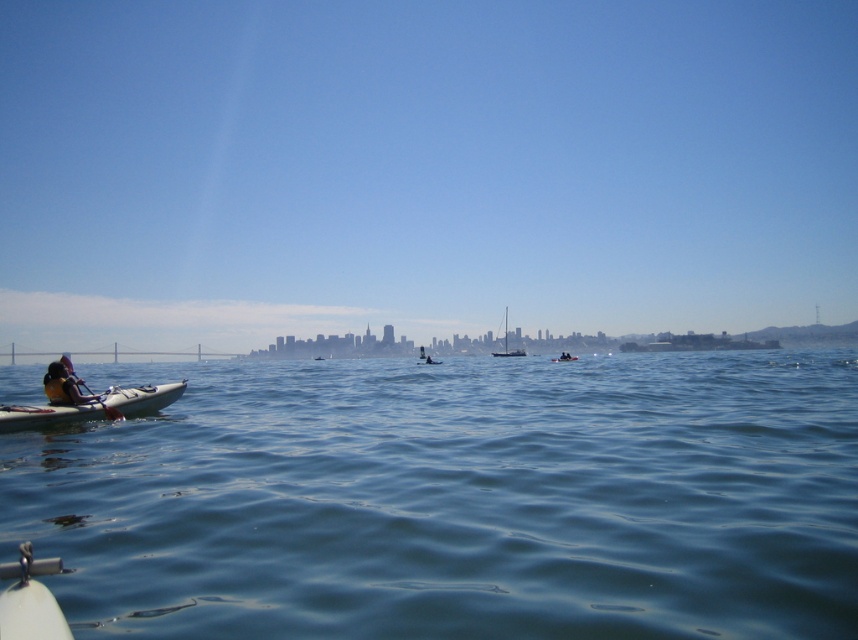
Looking at this image, is blue water at center wider than white sailboat at center?

Yes, blue water at center is wider than white sailboat at center.

Is blue water at center shorter than white sailboat at center?

Indeed, blue water at center has a lesser height compared to white sailboat at center.

Who is more forward, (536, 387) or (521, 353)?

Point (536, 387) is more forward.

Image resolution: width=858 pixels, height=640 pixels. I want to click on blue water at center, so click(455, 499).

Can you confirm if white sailboat at center is wider than white plastic kayak at center?

Yes.

Measure the distance between white sailboat at center and camera.

They are 137.22 meters apart.

You are a GUI agent. You are given a task and a screenshot of the screen. Output one action in this format:
    pyautogui.click(x=<x>, y=<y>)
    Task: Click on the white sailboat at center
    This screenshot has width=858, height=640.
    Given the screenshot: What is the action you would take?
    pyautogui.click(x=506, y=346)

Between point (506, 339) and point (418, 362), which one is positioned behind?

Point (506, 339)

Between white sailboat at center and white matte kayak at center, which one has less height?

white matte kayak at center is shorter.

This screenshot has height=640, width=858. Find the location of `white sailboat at center`. white sailboat at center is located at coordinates (506, 346).

Where is `white sailboat at center`? This screenshot has width=858, height=640. white sailboat at center is located at coordinates (506, 346).